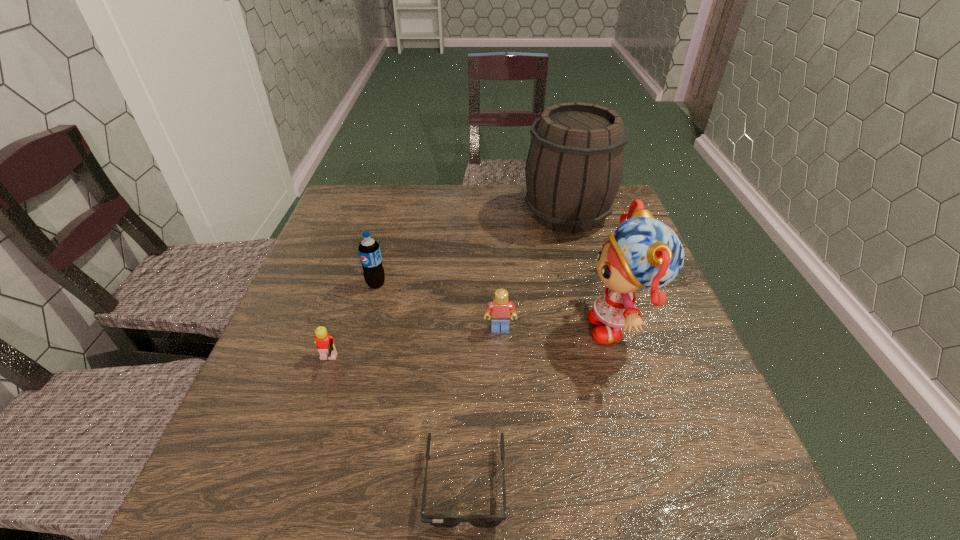
The height and width of the screenshot is (540, 960). I want to click on vacant region located 0.270m on the left of the farthest object, so click(431, 213).

Find the location of a particular element. vacant area situated 0.400m on the face of the doll is located at coordinates (402, 327).

Identify the location of blank space located on the face of the doll. (520, 327).

Find the location of a particular element. The width and height of the screenshot is (960, 540). vacant space situated on the face of the doll is located at coordinates (498, 327).

Where is `free spot located 0.330m on the right of the fifth object from right to left`? This screenshot has width=960, height=540. free spot located 0.330m on the right of the fifth object from right to left is located at coordinates (521, 284).

Where is `vacant area situated on the front-facing side of the third shortest object`? The image size is (960, 540). vacant area situated on the front-facing side of the third shortest object is located at coordinates (507, 481).

The height and width of the screenshot is (540, 960). I want to click on vacant space located in front of the shorter Lego with the accessory visible, so click(473, 362).

This screenshot has width=960, height=540. What are the coordinates of `object at the far edge` in the screenshot? It's located at (574, 167).

The width and height of the screenshot is (960, 540). Identify the location of object that is at the near edge. (440, 521).

Locate an element on the screen. The width and height of the screenshot is (960, 540). object that is at the left edge is located at coordinates (324, 342).